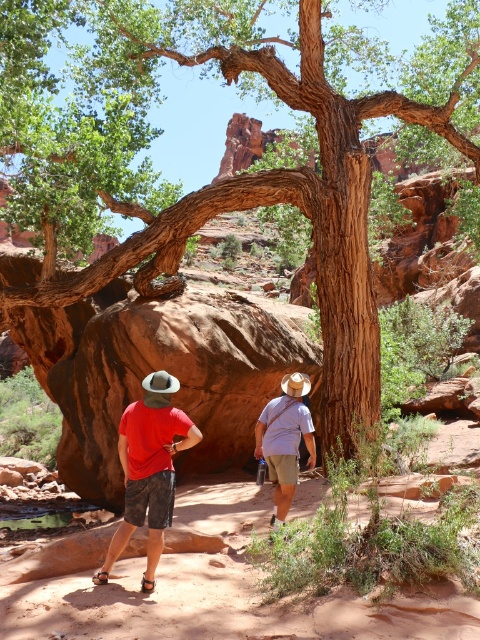
Question: Which of the following is the farthest from the observer?

Choices:
 (A) matte red shirt at center
 (B) light blue cotton shirt at center
 (C) camouflage shorts at center

Answer: (B)

Question: Which of the following is the closest to the observer?

Choices:
 (A) matte red shirt at center
 (B) camouflage shorts at center
 (C) light blue cotton shirt at center

Answer: (A)

Question: Which point appears closest to the camera in this image?

Choices:
 (A) (282, 435)
 (B) (147, 460)

Answer: (B)

Question: Does camouflage shorts at center have a larger size compared to light blue cotton shirt at center?

Choices:
 (A) yes
 (B) no

Answer: (A)

Question: Does camouflage shorts at center appear over light blue cotton shirt at center?

Choices:
 (A) yes
 (B) no

Answer: (A)

Question: Is camouflage shorts at center positioned in front of matte red shirt at center?

Choices:
 (A) yes
 (B) no

Answer: (B)